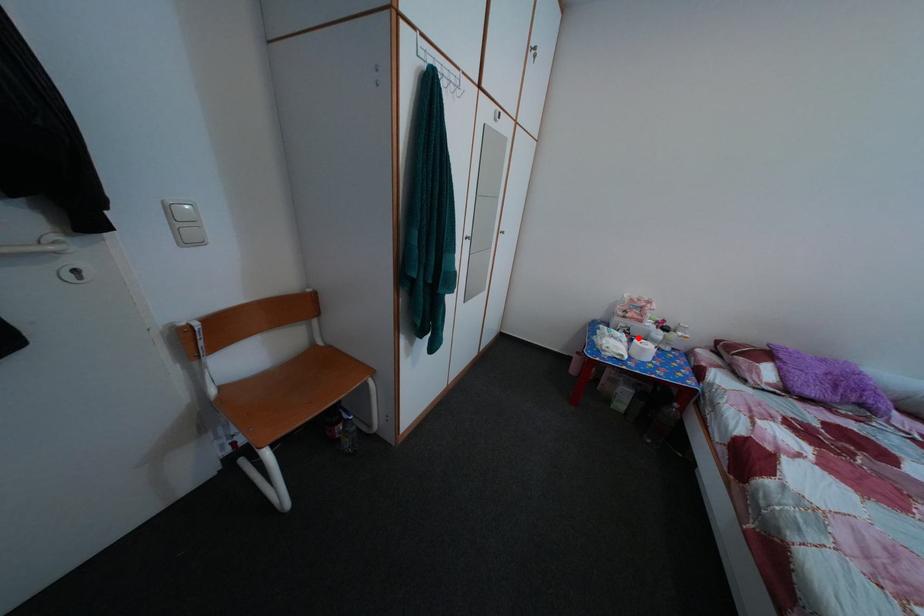
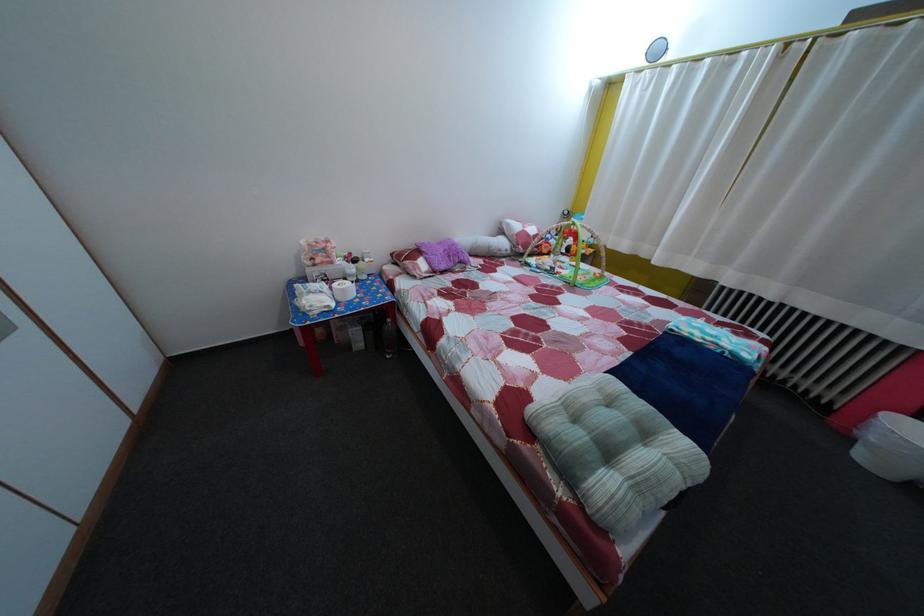
The point at the highlighted location is marked in the first image. Where is the corresponding point in the second image?

(335, 284)